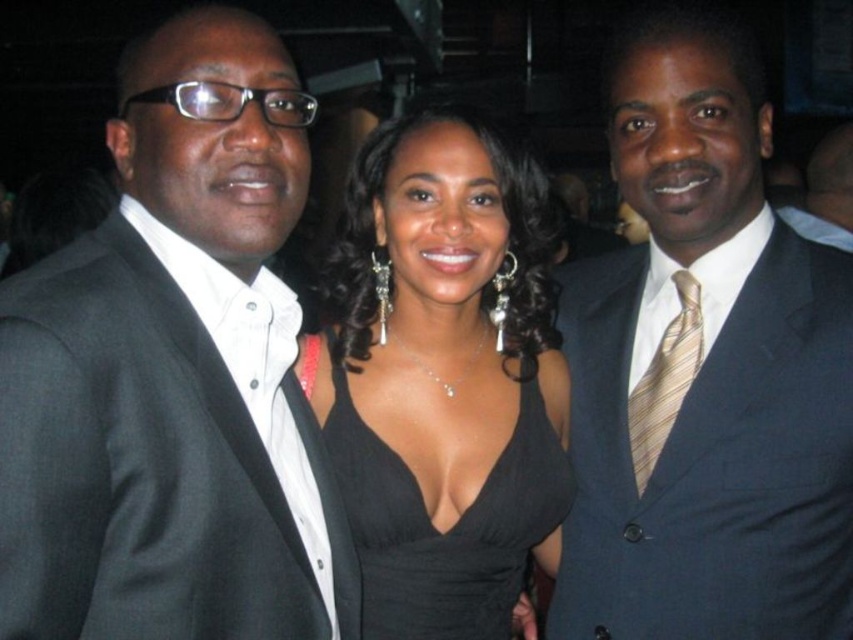
How much distance is there between black suit at left and black satin dress at center?

black suit at left and black satin dress at center are 13.55 inches apart.

The width and height of the screenshot is (853, 640). I want to click on black suit at left, so click(173, 376).

Which is behind, point (144, 96) or point (595, 609)?

The point (595, 609) is more distant.

Is point (184, 211) positioned before point (665, 305)?

Yes, it is.

Identify the location of black suit at left. This screenshot has width=853, height=640. (173, 376).

Is shiny navy suit at center positioned in front of black satin dress at center?

Yes, shiny navy suit at center is closer to the viewer.

Between shiny navy suit at center and black satin dress at center, which one appears on the right side from the viewer's perspective?

Positioned to the right is shiny navy suit at center.

The height and width of the screenshot is (640, 853). I want to click on shiny navy suit at center, so click(x=706, y=369).

Find the location of a particular element. This screenshot has height=640, width=853. shiny navy suit at center is located at coordinates (706, 369).